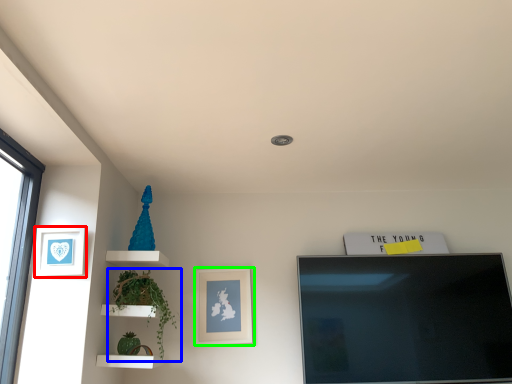
Question: Which object is the closest to the picture frame (highlighted by a red box)? Choose among these: plant (highlighted by a blue box) or picture frame (highlighted by a green box).

Choices:
 (A) plant
 (B) picture frame

Answer: (A)